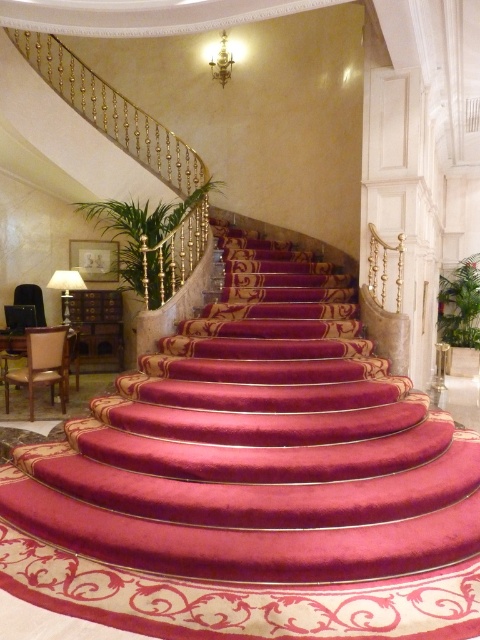
You are standing at the bottom of the staircase and see the point marked as point (66, 288). What object does this point correspond to?

The point (66, 288) corresponds to the matte gold lamp at left.

You are an interior designer assessing the lighting in this luxurious staircase area. You notice the matte gold lamp at left and the gold metallic chandelier at upper center. Which of these two fixtures is bigger in size?

The matte gold lamp at left is larger in size compared to the gold metallic chandelier at upper center.

You are standing at the base of the staircase and want to hang a new picture frame between the matte gold lamp at left and the gold metallic chandelier at upper center. Which object should the picture frame be placed closer to in order to maintain symmetry?

The picture frame should be placed closer to the matte gold lamp at left because it is in front of the gold metallic chandelier at upper center, so positioning it closer to the lamp would help maintain symmetry by balancing the distance between both objects.